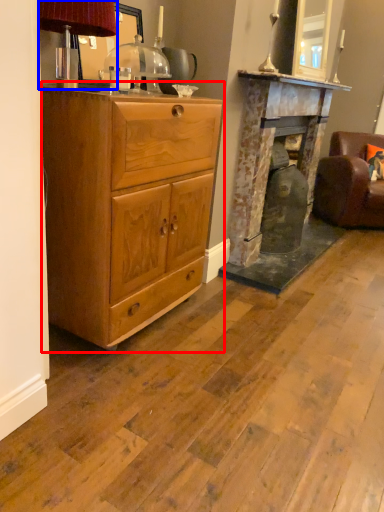
Question: Among these objects, which one is nearest to the camera, chest of drawers (highlighted by a red box) or table lamp (highlighted by a blue box)?

Choices:
 (A) chest of drawers
 (B) table lamp

Answer: (B)